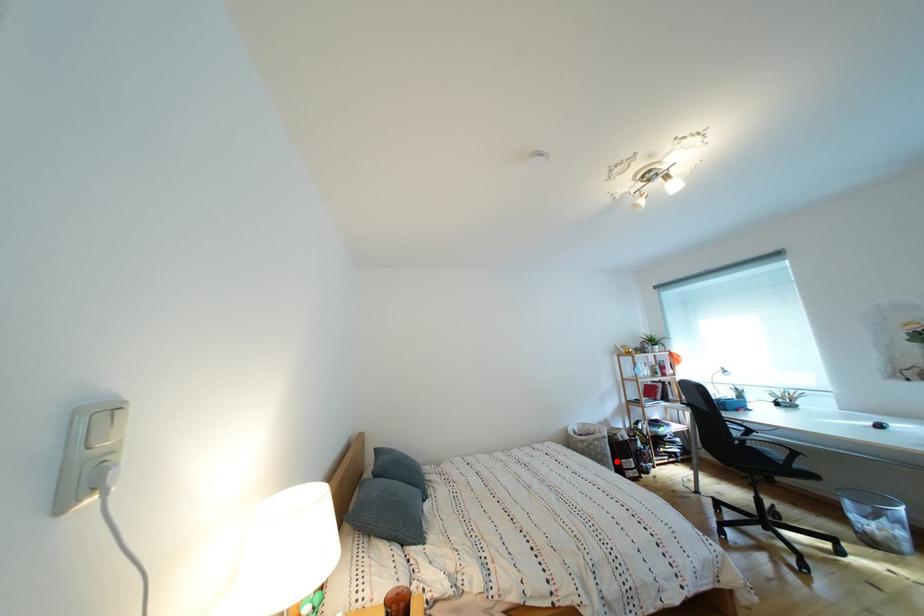
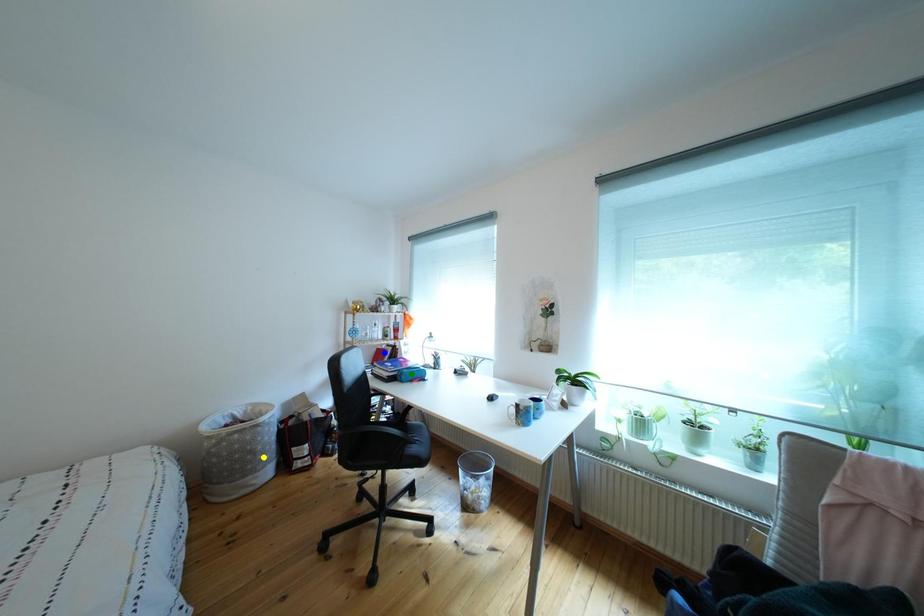
Question: I am providing you with two images of the same scene from different viewpoints. A red point is marked on the first image. You are given multiple points on the second image. Which spot in image 2 lines up with the point in image 1?

Choices:
 (A) blue point
 (B) yellow point
 (C) green point

Answer: (B)